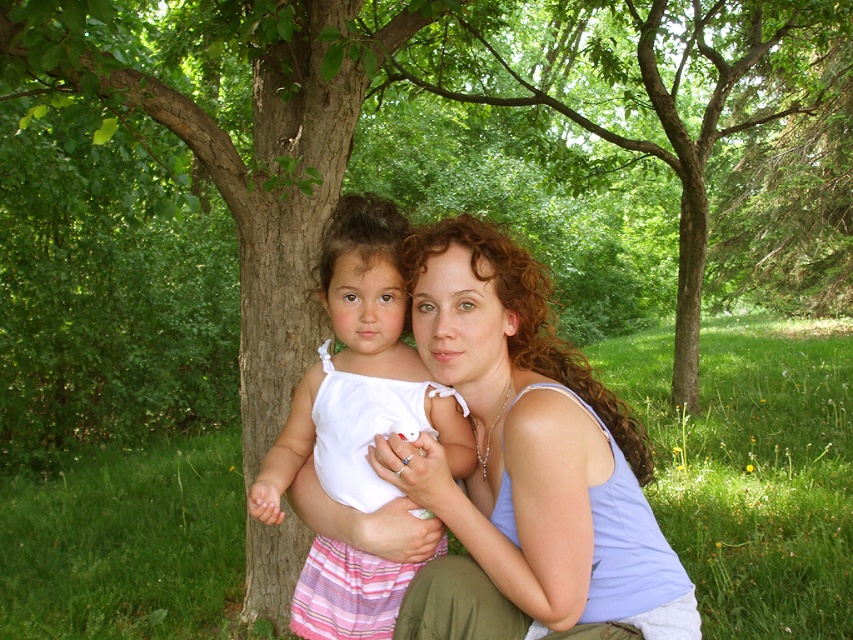
Question: Is green leafy tree at center above light blue tank top at center?

Choices:
 (A) no
 (B) yes

Answer: (B)

Question: Which point is farther from the camera taking this photo?

Choices:
 (A) (323, 404)
 (B) (747, 156)

Answer: (B)

Question: Which of the following is the farthest from the observer?

Choices:
 (A) (433, 42)
 (B) (444, 563)
 (C) (368, 228)

Answer: (A)

Question: Observing the image, what is the correct spatial positioning of green leafy tree at center in reference to light blue tank top at center?

Choices:
 (A) above
 (B) below

Answer: (A)

Question: Does green leafy tree at center have a larger size compared to light blue tank top at center?

Choices:
 (A) no
 (B) yes

Answer: (B)

Question: Estimate the real-world distances between objects in this image. Which object is farther from the white cotton dress at center?

Choices:
 (A) green leafy tree at center
 (B) light blue tank top at center

Answer: (A)